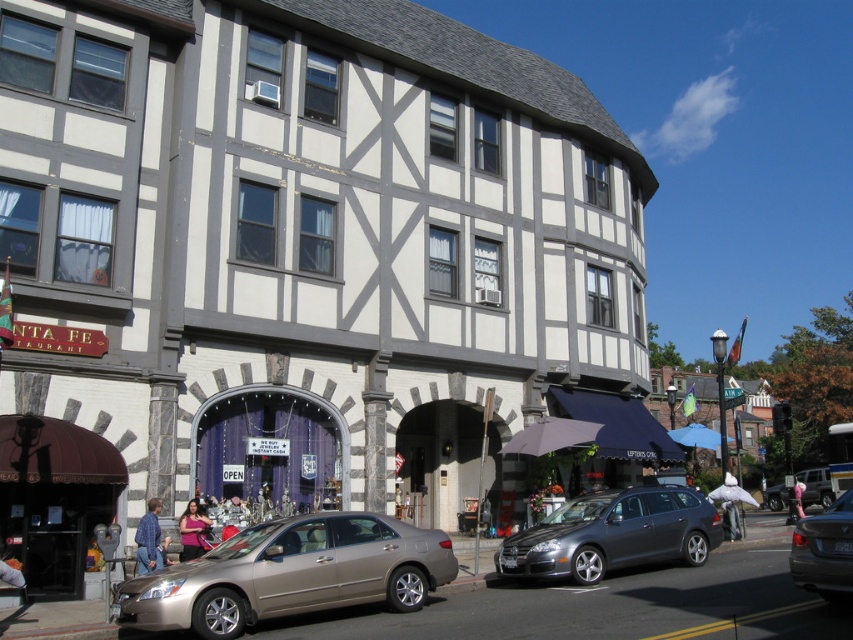
You are standing in front of the Santa Fe Restaurant and want to walk to the point marked as point (631, 525). Which direction should you move relative to the point marked as point (314, 531)?

To reach point (631, 525) from point (314, 531), you should move downward since point (314, 531) is closer to the viewer and above point (631, 525).

You are a pedestrian standing on the sidewalk in front of the Santa Fe Restaurant. You see the metallic gray station wagon at center and the metallic silver sedan at center. Which vehicle is closer to you?

The metallic gray station wagon at center is closer to you because it is positioned further to the viewer than the metallic silver sedan at center.

Based on the photo, you are standing in front of the Santa Fe Restaurant and want to take a photo of the entrance. There are two points marked on your camera screen at coordinates point (329, 586) and point (830, 580). Which point is closer to the entrance of the restaurant?

Point (830, 580) is closer to the entrance of the Santa Fe Restaurant because it is in front of point (329, 586), which is behind it.